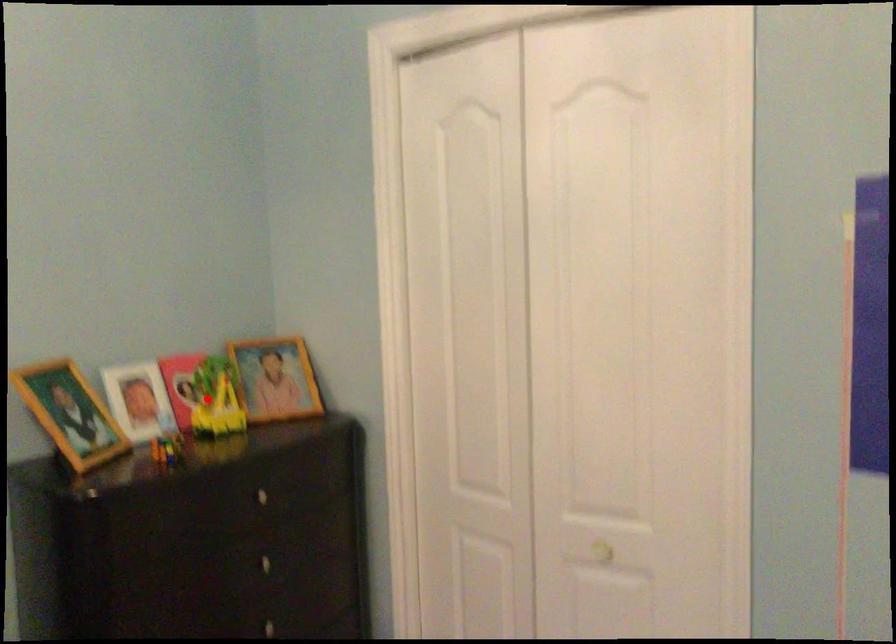
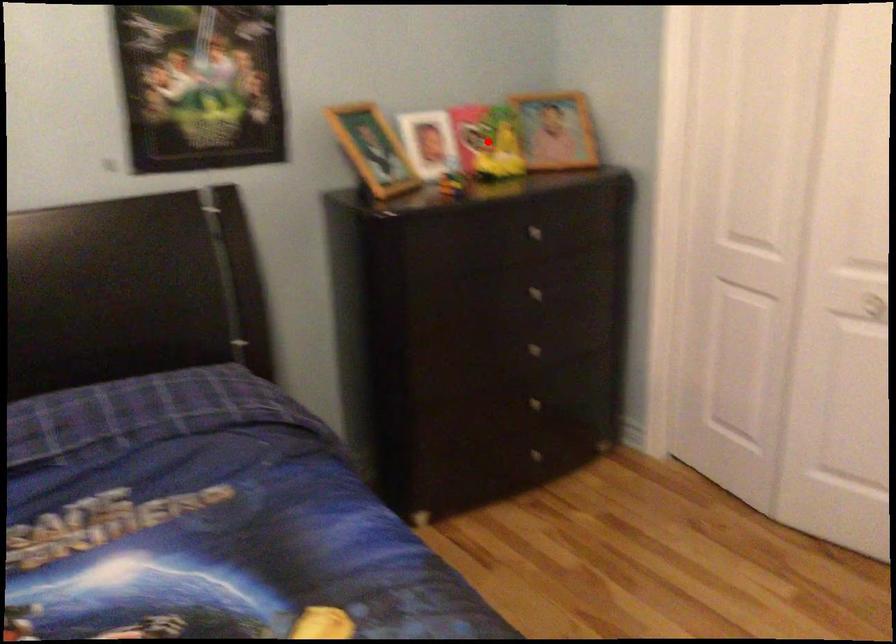
I am providing you with two images of the same scene from different viewpoints. A red point is marked on the first image and another point is marked on the second image. Is the marked point in image1 the same physical position as the marked point in image2?

Yes